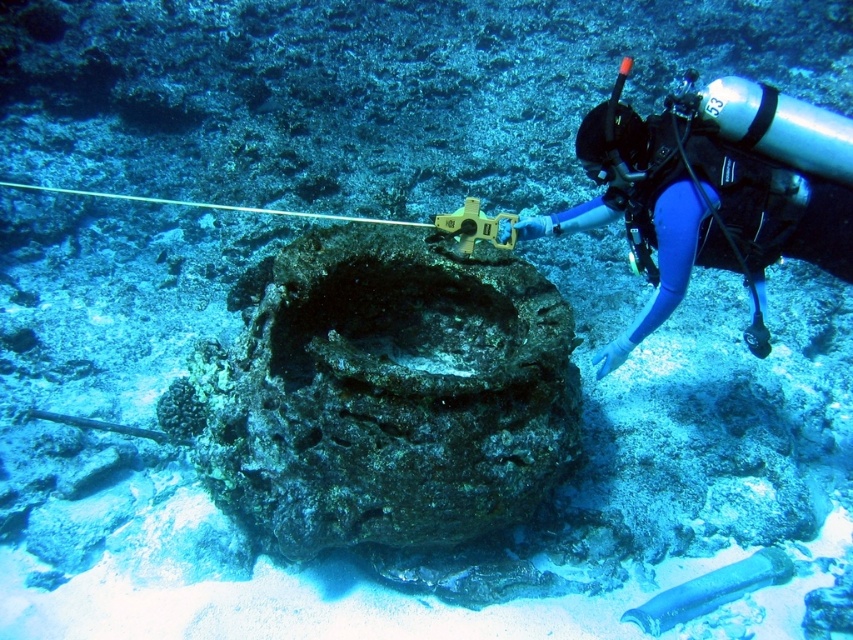
You are an underwater photographer planning to capture a wide shot of both the blue neoprene wetsuit at center and the translucent blue glass pipe at lower center. Given the camera you are using has a maximum width coverage of 1.2 meters, can both objects fit in the frame without moving the camera?

The blue neoprene wetsuit at center is wider than the translucent blue glass pipe at lower center. However, since the camera can cover up to 1.2 meters, and the combined width of both objects is not specified, it is uncertain if they will fit without knowing their exact dimensions. Please provide more details about their individual widths.

You are an underwater archaeologist examining the ocean floor. You notice the rusty metallic rock at center and the blue neoprene wetsuit at center. Which object is bigger in size?

The rusty metallic rock at center is larger in size compared to the blue neoprene wetsuit at center.

You are a marine biologist examining an underwater site. You need to determine which object is taller between the rusty metallic rock at center and the translucent blue glass pipe at lower center. Based on the scene, which one is taller?

The rusty metallic rock at center is taller than the translucent blue glass pipe at lower center according to the description.